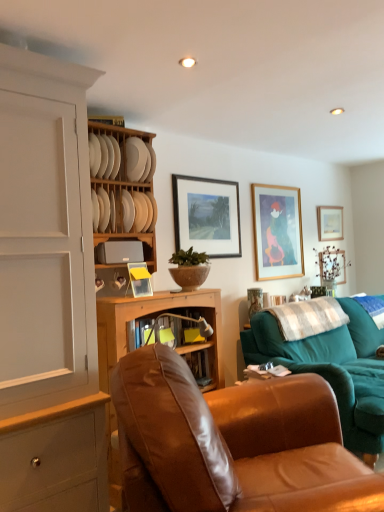
Describe the element at coordinates (135, 158) in the screenshot. I see `white matte plate at upper center, arranged as the 1th plate when viewed from the top` at that location.

Measure the distance between point (304, 333) and camera.

3.01 meters.

What do you see at coordinates (122, 194) in the screenshot?
I see `natural wood plate rack at upper center, the 2th shelf from the bottom` at bounding box center [122, 194].

The width and height of the screenshot is (384, 512). Describe the element at coordinates (128, 241) in the screenshot. I see `matte gray toaster at center, the second shelf when ordered from top to bottom` at that location.

Measure the distance between matte gray toaster at center, the second shelf when ordered from top to bottom, and camera.

They are 7.84 feet apart.

At what (x,y) coordinates should I click in order to perform the action: click on wooden-framed painting at center, marked as the 4th picture frame in a right-to-left arrangement. Please return your answer as a coordinate pair (x, y). Looking at the image, I should click on (207, 216).

From the image's perspective, relative to white checkered fabric at right, the first pillow from the front, is white matte plate at upper center, acting as the 2th plate starting from the top, above or below?

Based on their image positions, white matte plate at upper center, acting as the 2th plate starting from the top, is located above white checkered fabric at right, the first pillow from the front.

Is white matte plate at upper center, acting as the 2th plate starting from the top, inside or outside of white checkered fabric at right, which is the first pillow from left to right?

white matte plate at upper center, acting as the 2th plate starting from the top, is not enclosed by white checkered fabric at right, which is the first pillow from left to right.

What are the coordinates of `the 1st pillow behind the white matte plate at upper center, the 1th plate in the bottom-to-top sequence` in the screenshot? It's located at (308, 317).

Is white matte plate at upper center, acting as the 2th plate starting from the top, beside white checkered fabric at right, which is the first pillow from left to right?

white matte plate at upper center, acting as the 2th plate starting from the top, is not next to white checkered fabric at right, which is the first pillow from left to right, and they're not touching.

Does white soft pillow at right, placed as the first pillow when sorted from right to left, appear on the right side of matte gray toaster at center, the second shelf when ordered from top to bottom?

Correct, you'll find white soft pillow at right, placed as the first pillow when sorted from right to left, to the right of matte gray toaster at center, the second shelf when ordered from top to bottom.

Based on the photo, is white soft pillow at right, arranged as the 1th pillow when viewed from the back, closer to the viewer compared to matte gray toaster at center, the 1th shelf positioned from the bottom?

No.

Who is bigger, white soft pillow at right, placed as the first pillow when sorted from right to left, or matte gray toaster at center, the second shelf when ordered from top to bottom?

Bigger between the two is white soft pillow at right, placed as the first pillow when sorted from right to left.

Can you tell me how much white soft pillow at right, the second pillow in the left-to-right sequence, and matte gray toaster at center, the 1th shelf positioned from the bottom, differ in facing direction?

There is a 3.45-degree angle between the facing directions of white soft pillow at right, the second pillow in the left-to-right sequence, and matte gray toaster at center, the 1th shelf positioned from the bottom.

Can you confirm if wooden picture frame at upper right, which is counted as the third picture frame, starting from the front, is bigger than teal fabric couch at right?

No, wooden picture frame at upper right, which is counted as the third picture frame, starting from the front, is not bigger than teal fabric couch at right.

Can you confirm if wooden picture frame at upper right, marked as the 2th picture frame in a right-to-left arrangement, is thinner than teal fabric couch at right?

Yes, wooden picture frame at upper right, marked as the 2th picture frame in a right-to-left arrangement, is thinner than teal fabric couch at right.

How distant is wooden picture frame at upper right, which is the 2th picture frame in back-to-front order, from teal fabric couch at right?

A distance of 5.28 feet exists between wooden picture frame at upper right, which is the 2th picture frame in back-to-front order, and teal fabric couch at right.

Identify the location of the 4th picture frame positioned above the teal fabric couch at right (from the image's perspective). (330, 223).

Is brown leather chair at center taller or shorter than white matte plate at upper center, acting as the second plate starting from the bottom?

brown leather chair at center is taller than white matte plate at upper center, acting as the second plate starting from the bottom.

From the image's perspective, which object appears higher, brown leather chair at center or white matte plate at upper center, arranged as the 1th plate when viewed from the top?

white matte plate at upper center, arranged as the 1th plate when viewed from the top, appears higher in the image.

Can you confirm if brown leather chair at center is wider than white matte plate at upper center, acting as the second plate starting from the bottom?

Indeed, brown leather chair at center has a greater width compared to white matte plate at upper center, acting as the second plate starting from the bottom.

Does point (167, 362) lie in front of point (134, 143)?

Yes, point (167, 362) is closer to viewer.

Considering the positions of objects teal fabric couch at right and gold-framed artwork at upper right, the 3th picture frame when ordered from back to front, in the image provided, who is more to the right, teal fabric couch at right or gold-framed artwork at upper right, the 3th picture frame when ordered from back to front,?

teal fabric couch at right.

Does point (314, 335) come farther from viewer compared to point (265, 266)?

No, (314, 335) is in front of (265, 266).

Is teal fabric couch at right bigger or smaller than gold-framed artwork at upper right, which appears as the third picture frame when viewed from the right?

Clearly, teal fabric couch at right is larger in size than gold-framed artwork at upper right, which appears as the third picture frame when viewed from the right.

Would you say teal fabric couch at right contains gold-framed artwork at upper right, the 3th picture frame when ordered from back to front?

No, gold-framed artwork at upper right, the 3th picture frame when ordered from back to front, is not inside teal fabric couch at right.

Where is `the 1st shelf in front of the white matte plate at upper center, the 1th plate in the bottom-to-top sequence`? The image size is (384, 512). the 1st shelf in front of the white matte plate at upper center, the 1th plate in the bottom-to-top sequence is located at coordinates [128, 241].

Would you say matte gray toaster at center, the 1th shelf positioned from the bottom, is outside white matte plate at upper center, acting as the 2th plate starting from the top?

Yes, matte gray toaster at center, the 1th shelf positioned from the bottom, is located beyond the bounds of white matte plate at upper center, acting as the 2th plate starting from the top.

Looking at this image, does matte gray toaster at center, the second shelf when ordered from top to bottom, appear on the left side of white matte plate at upper center, acting as the 2th plate starting from the top?

No.

From the picture: Visually, is white checkered fabric at right, the first pillow from the front, positioned to the left or to the right of wooden picture frame at upper right, which is the 2th picture frame in back-to-front order?

Clearly, white checkered fabric at right, the first pillow from the front, is on the left of wooden picture frame at upper right, which is the 2th picture frame in back-to-front order, in the image.

Between white checkered fabric at right, the second pillow positioned from the back, and wooden picture frame at upper right, which appears as the third picture frame when viewed from the left, which one has smaller width?

wooden picture frame at upper right, which appears as the third picture frame when viewed from the left, is thinner.

Would you say white checkered fabric at right, the second pillow positioned from the back, is inside or outside wooden picture frame at upper right, which is the 2th picture frame in back-to-front order?

white checkered fabric at right, the second pillow positioned from the back, exists outside the volume of wooden picture frame at upper right, which is the 2th picture frame in back-to-front order.

How distant is white checkered fabric at right, the second pillow positioned from the back, from wooden picture frame at upper right, which is the 2th picture frame in back-to-front order?

white checkered fabric at right, the second pillow positioned from the back, and wooden picture frame at upper right, which is the 2th picture frame in back-to-front order, are 1.28 meters apart.

This screenshot has width=384, height=512. Identify the location of the 1st pillow positioned below the white matte plate at upper center, the 1th plate in the bottom-to-top sequence (from the image's perspective). (308, 317).

From a real-world perspective, count 1st shelfs upward from the white soft pillow at right, placed as the first pillow when sorted from right to left, and point to it. Please provide its 2D coordinates.

[(128, 241)]

Considering their positions, is gold-framed artwork at upper right, which appears as the third picture frame when viewed from the right, positioned further to wooden-framed painting at center, positioned as the fourth picture frame in back-to-front order, than wooden picture frame at upper right, which appears as the third picture frame when viewed from the left?

wooden picture frame at upper right, which appears as the third picture frame when viewed from the left, is positioned further to the anchor wooden-framed painting at center, positioned as the fourth picture frame in back-to-front order.

Which object lies further to the anchor point wooden picture frame at upper right, arranged as the 4th picture frame when viewed from the left, teal fabric couch at right or gold-framed artwork at upper right, which ranks as the 2th picture frame in left-to-right order?

The object further to wooden picture frame at upper right, arranged as the 4th picture frame when viewed from the left, is teal fabric couch at right.

Which object lies further to the anchor point teal fabric couch at right, white soft pillow at right, placed as the first pillow when sorted from right to left, or white matte plate at upper center, arranged as the 1th plate when viewed from the top?

white matte plate at upper center, arranged as the 1th plate when viewed from the top, is positioned further to the anchor teal fabric couch at right.

Based on the photo, which object lies nearer to the anchor point wooden-framed painting at center, positioned as the fourth picture frame in back-to-front order, brown leather chair at center or wooden picture frame at upper right, arranged as the 4th picture frame when viewed from the left?

The object closer to wooden-framed painting at center, positioned as the fourth picture frame in back-to-front order, is wooden picture frame at upper right, arranged as the 4th picture frame when viewed from the left.

From the image, which object appears to be nearer to white matte plate at upper center, acting as the second plate starting from the bottom, wooden picture frame at upper right, which appears as the third picture frame when viewed from the left, or natural wood plate rack at upper center, the 2th shelf from the bottom?

natural wood plate rack at upper center, the 2th shelf from the bottom.

From the image, which object appears to be nearer to teal fabric couch at right, white painted wood cabinet at left or matte gray toaster at center, the 1th shelf positioned from the bottom?

matte gray toaster at center, the 1th shelf positioned from the bottom, lies closer to teal fabric couch at right than the other object.

Estimate the real-world distances between objects in this image. Which object is further from white matte plate at upper center, acting as the 2th plate starting from the top, brown leather chair at center or teal fabric couch at right?

Among the two, teal fabric couch at right is located further to white matte plate at upper center, acting as the 2th plate starting from the top.

Estimate the real-world distances between objects in this image. Which object is closer to matte gray toaster at center, the 1th shelf positioned from the bottom, natural wood plate rack at upper center, positioned as the 1th shelf in top-to-bottom order, or white painted wood cabinet at left?

Based on the image, natural wood plate rack at upper center, positioned as the 1th shelf in top-to-bottom order, appears to be nearer to matte gray toaster at center, the 1th shelf positioned from the bottom.

Identify the location of picture frame situated between white matte plate at upper center, the 1th plate in the bottom-to-top sequence, and gold-framed artwork at upper right, which appears as the third picture frame when viewed from the right, from left to right. This screenshot has width=384, height=512. (207, 216).

The width and height of the screenshot is (384, 512). I want to click on plate situated between white matte plate at upper center, acting as the 2th plate starting from the top, and teal fabric couch at right from left to right, so click(x=135, y=158).

Where is `studio couch between wooden-framed painting at center, marked as the first picture frame in a front-to-back arrangement, and white soft pillow at right, placed as the first pillow when sorted from right to left, from left to right`? The width and height of the screenshot is (384, 512). studio couch between wooden-framed painting at center, marked as the first picture frame in a front-to-back arrangement, and white soft pillow at right, placed as the first pillow when sorted from right to left, from left to right is located at coordinates (332, 370).

Find the location of a particular element. pillow between white matte plate at upper center, the 1th plate in the bottom-to-top sequence, and wooden picture frame at upper right, which is counted as the third picture frame, starting from the front, from left to right is located at coordinates (308, 317).